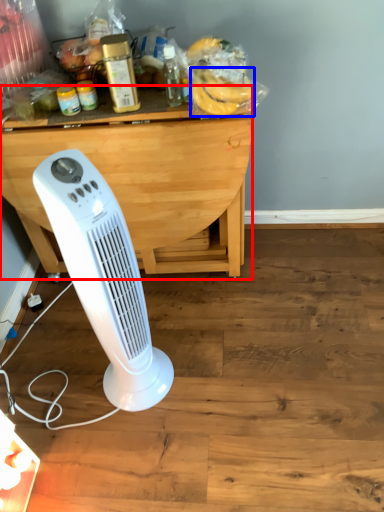
Question: Which of the following is the farthest to the observer, table (highlighted by a red box) or banana (highlighted by a blue box)?

Choices:
 (A) table
 (B) banana

Answer: (A)